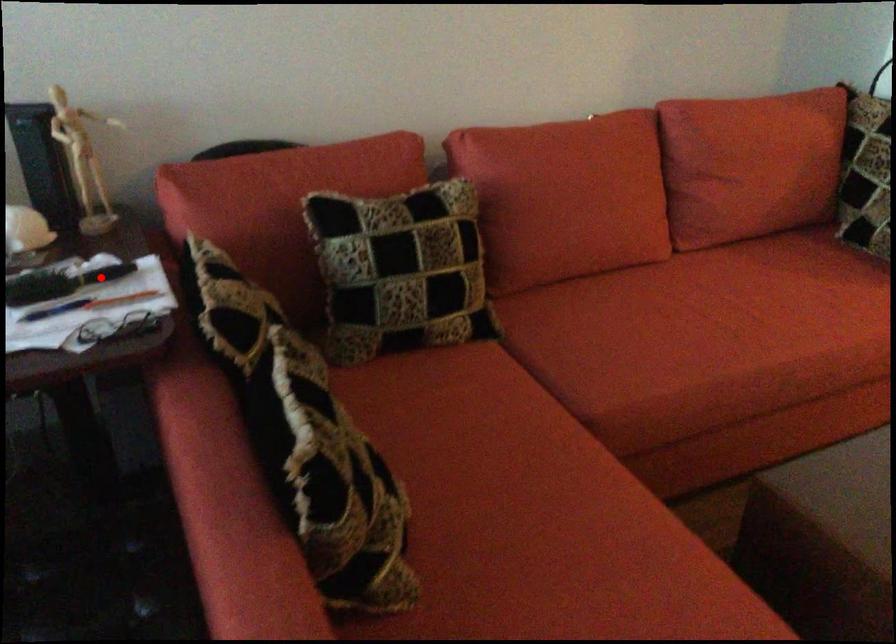
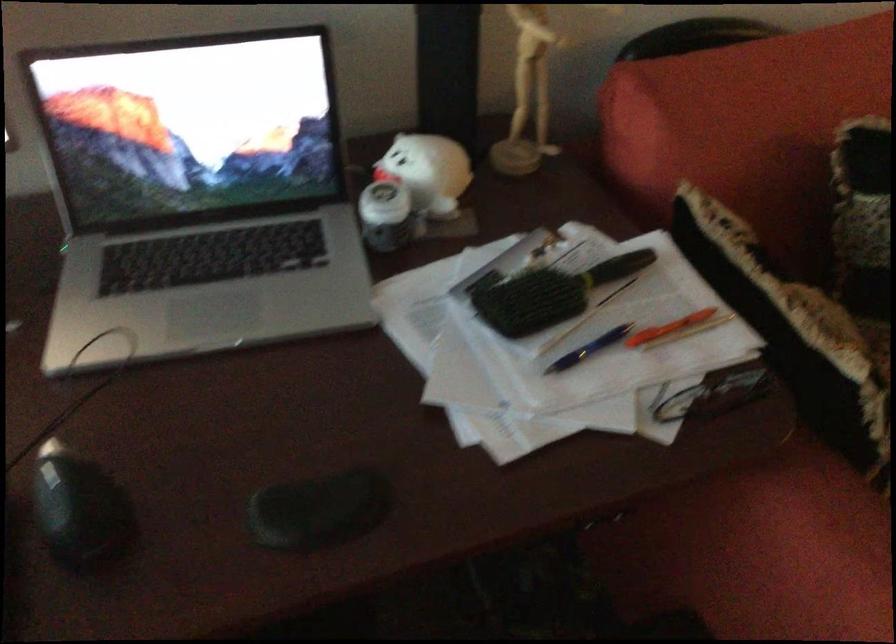
In the second image, find the point that corresponds to the highlighted location in the first image.

(616, 267)